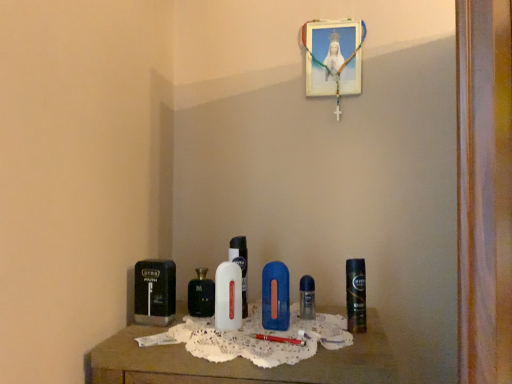
Where is `vacant region to the right of white plastic bottle at center, which appears as the 2th perfume when viewed from the front`? This screenshot has width=512, height=384. vacant region to the right of white plastic bottle at center, which appears as the 2th perfume when viewed from the front is located at coordinates (303, 325).